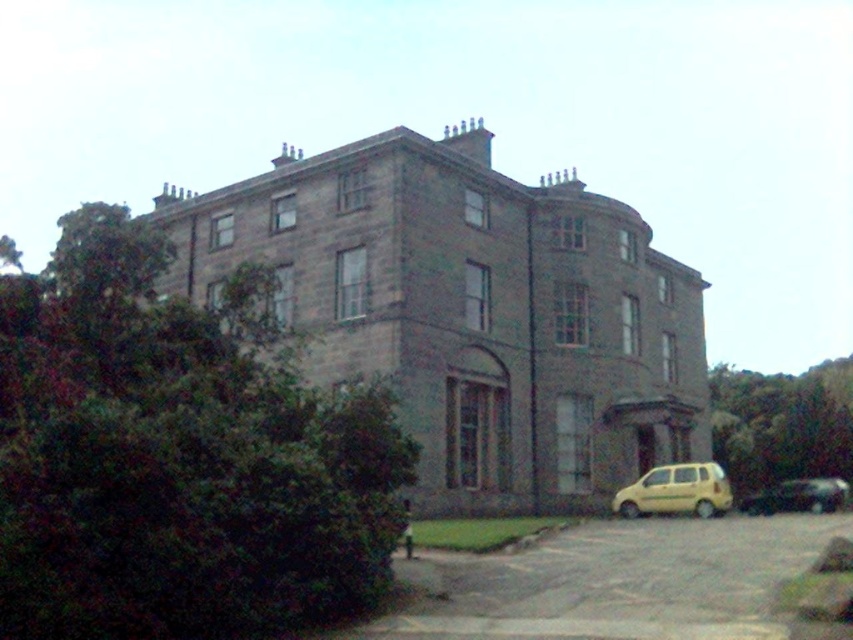
You are standing in front of the mansion and want to take a photo of the two points marked on the building. Which point, point (660, 499) or point (811, 496), will appear larger in your photo?

Point (660, 499) will appear larger in the photo because it is closer to the camera than point (811, 496).

You are standing at the entrance of the large stone building and want to park your car in the closest available spot. The yellow matte van at lower right is located at point (676,492). Where should you park your car?

The yellow matte van at lower right is located at point (676,492), so you should park your car there as it is the closest available spot.

You are a delivery driver who needs to park your vehicle in the parking lot in front of the historic mansion. You have a yellow matte van at lower right and a shiny black car at lower right available. Which vehicle would require less space to park?

The yellow matte van at lower right occupies less space than the shiny black car at lower right, so the yellow matte van at lower right would require less space to park.